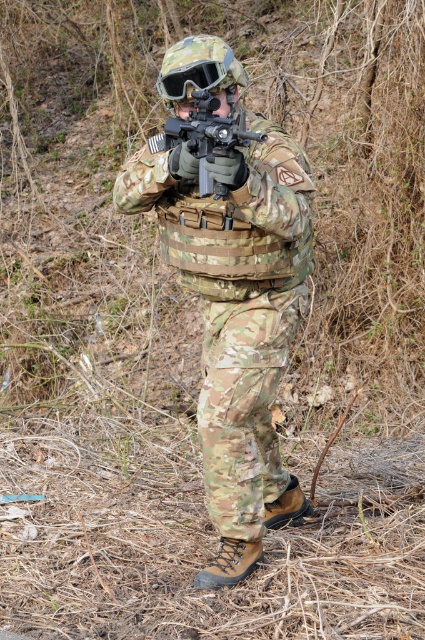
Can you confirm if camo uniform at center is positioned below matte black rifle at center?

Yes, camo uniform at center is below matte black rifle at center.

Is camo uniform at center bigger than matte black rifle at center?

Indeed, camo uniform at center has a larger size compared to matte black rifle at center.

Is point (308, 513) positioned in front of point (176, 145)?

No, it is not.

I want to click on camo uniform at center, so click(x=237, y=317).

Find the location of a particular element. matte black rifle at center is located at coordinates (206, 138).

Who is positioned more to the right, camo uniform at center or matte green plastic goggles at upper center?

Positioned to the right is camo uniform at center.

Between point (305, 305) and point (204, 76), which one is positioned behind?

Point (305, 305)

This screenshot has height=640, width=425. Identify the location of camo uniform at center. (237, 317).